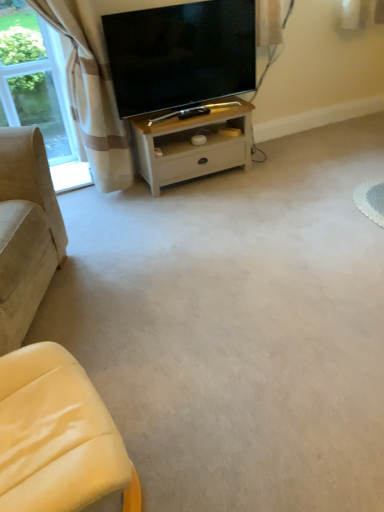
At what (x,y) coordinates should I click in order to perform the action: click on unoccupied region to the right of yellow leather studio couch at lower left, which appears as the second studio couch when viewed from the left. Please return your answer as a coordinate pair (x, y). Looking at the image, I should click on (204, 448).